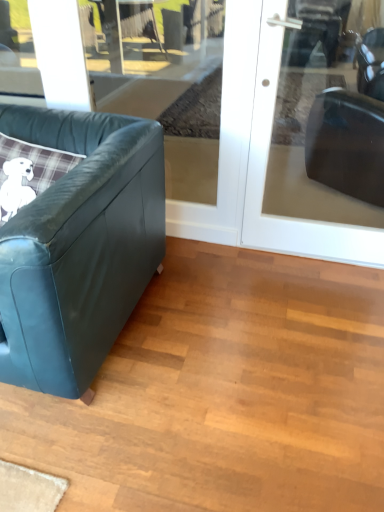
What do you see at coordinates (79, 246) in the screenshot?
I see `leather couch at left` at bounding box center [79, 246].

At what (x,y) coordinates should I click in order to perform the action: click on transparent glass door at upper right. Please return your answer as a coordinate pair (x, y). The image size is (384, 512). Looking at the image, I should click on (266, 170).

From a real-world perspective, is leather couch at left on top of transparent glass door at upper right?

No, from a real-world perspective, leather couch at left is not over transparent glass door at upper right

In terms of height, does leather couch at left look taller or shorter compared to transparent glass door at upper right?

leather couch at left is shorter than transparent glass door at upper right.

Which of these two, leather couch at left or transparent glass door at upper right, is wider?

With larger width is leather couch at left.

Who is more distant, leather couch at left or transparent glass door at upper right?

transparent glass door at upper right is behind.

Is transparent glass door at upper right far away from leather couch at left?

No.

Measure the distance from transparent glass door at upper right to leather couch at left.

transparent glass door at upper right is 33.83 inches from leather couch at left.

Locate an element on the screen. door above the leather couch at left (from the image's perspective) is located at coordinates (266, 170).

Based on their sizes in the image, would you say transparent glass door at upper right is bigger or smaller than leather couch at left?

In the image, transparent glass door at upper right appears to be smaller than leather couch at left.

Is transparent glass door at upper left bigger than transparent glass door at upper right?

Incorrect, transparent glass door at upper left is not larger than transparent glass door at upper right.

Is point (168, 118) farther from camera compared to point (268, 89)?

Yes, it is.

Is transparent glass door at upper left looking in the opposite direction of transparent glass door at upper right?

No.

How many degrees apart are the facing directions of transparent glass door at upper left and transparent glass door at upper right?

The angle between the facing direction of transparent glass door at upper left and the facing direction of transparent glass door at upper right is 1.22 degrees.

In the scene shown: Does leather couch at left come in front of transparent glass door at upper left?

That is True.

This screenshot has width=384, height=512. Find the location of `window that is above the leather couch at left (from the image's perspective)`. window that is above the leather couch at left (from the image's perspective) is located at coordinates pos(166,82).

Is leather couch at left with transparent glass door at upper left?

There is a gap between leather couch at left and transparent glass door at upper left.

From a real-world perspective, which object stands above the other?

From a 3D spatial view, transparent glass door at upper left is above.

Considering the sizes of objects transparent glass door at upper left and leather couch at left in the image provided, who is smaller, transparent glass door at upper left or leather couch at left?

transparent glass door at upper left is smaller.

From the image's perspective, which object appears higher, transparent glass door at upper left or leather couch at left?

transparent glass door at upper left.

Considering the points (372, 241) and (8, 2), which point is behind, point (372, 241) or point (8, 2)?

The point (8, 2) is behind.

Is transparent glass door at upper right facing away from transparent glass door at upper left?

A: No, transparent glass door at upper right is not facing away from transparent glass door at upper left.

Are transparent glass door at upper right and transparent glass door at upper left making contact?

No, transparent glass door at upper right is not next to transparent glass door at upper left.

The image size is (384, 512). Identify the location of door positioned vertically above the leather couch at left (from a real-world perspective). (266, 170).

Find the location of a particular element. The width and height of the screenshot is (384, 512). studio couch on the left of transparent glass door at upper right is located at coordinates (79, 246).

Which object lies further to the anchor point transparent glass door at upper right, leather couch at left or transparent glass door at upper left?

Among the two, transparent glass door at upper left is located further to transparent glass door at upper right.

Based on their spatial positions, is leather couch at left or transparent glass door at upper right further from transparent glass door at upper left?

transparent glass door at upper right is further to transparent glass door at upper left.

When comparing their distances from transparent glass door at upper left, does transparent glass door at upper right or leather couch at left seem closer?

leather couch at left is closer to transparent glass door at upper left.

Estimate the real-world distances between objects in this image. Which object is further from leather couch at left, transparent glass door at upper right or transparent glass door at upper left?

Among the two, transparent glass door at upper left is located further to leather couch at left.

Estimate the real-world distances between objects in this image. Which object is closer to leather couch at left, transparent glass door at upper left or transparent glass door at upper right?

Among the two, transparent glass door at upper right is located nearer to leather couch at left.

Estimate the real-world distances between objects in this image. Which object is further from transparent glass door at upper right, transparent glass door at upper left or leather couch at left?

Among the two, transparent glass door at upper left is located further to transparent glass door at upper right.

I want to click on window between leather couch at left and transparent glass door at upper right, so click(166, 82).